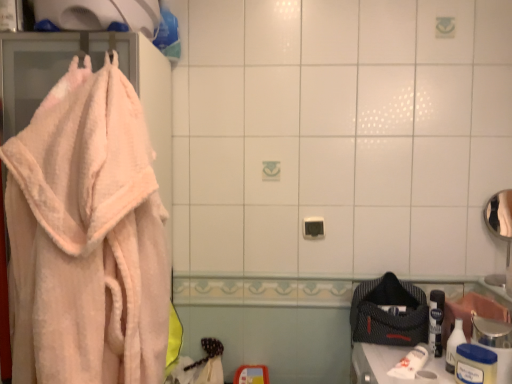
Question: Is peachy soft towel at left bigger or smaller than white plastic container at lower right, the 2th toiletry from the back?

Choices:
 (A) big
 (B) small

Answer: (A)

Question: Would you say peachy soft towel at left is inside or outside white plastic container at lower right, the 2th toiletry from the back?

Choices:
 (A) inside
 (B) outside

Answer: (B)

Question: Which is nearer to the white matte toilet paper at lower right?

Choices:
 (A) white plastic bottle at lower right, the 1th toiletry when ordered from back to front
 (B) peachy soft towel at left
 (C) white plastic container at lower right, the 2th toiletry from the back

Answer: (A)

Question: Which object is the closest to the white matte toilet paper at lower right?

Choices:
 (A) peachy soft towel at left
 (B) white plastic container at lower right, which is the first toiletry from front to back
 (C) white plastic bottle at lower right, the 1th toiletry when ordered from back to front

Answer: (C)